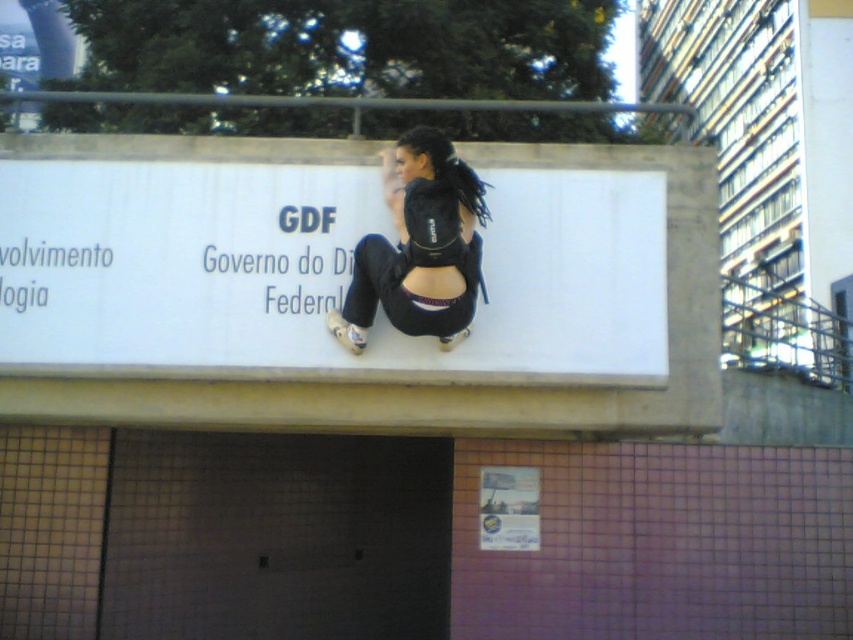
Based on the photo, you are a delivery person who needs to read the text on the white matte billboard at center. However, your black fabric backpack at center is blocking your view. Can you tell me which direction you should move your backpack to see the billboard?

The white matte billboard at center is below the black fabric backpack at center, so you should move your backpack upwards to see the billboard.

You are a delivery person who needs to place a package on the white matte billboard at center. The package is 20 inches long. Can you fit it on the billboard without overlapping the black fabric backpack at center?

The white matte billboard at center and black fabric backpack at center are 19.80 inches apart from each other. Since the package is 20 inches long, it would overlap the black fabric backpack at center when placed on the billboard.

You are a delivery person who needs to deliver a package to the black fabric backpack at center. You are currently facing the white matte billboard at center. Which direction should you move to reach the backpack?

The white matte billboard at center is positioned on the left side of the black fabric backpack at center, so you should move to the right to reach the backpack.